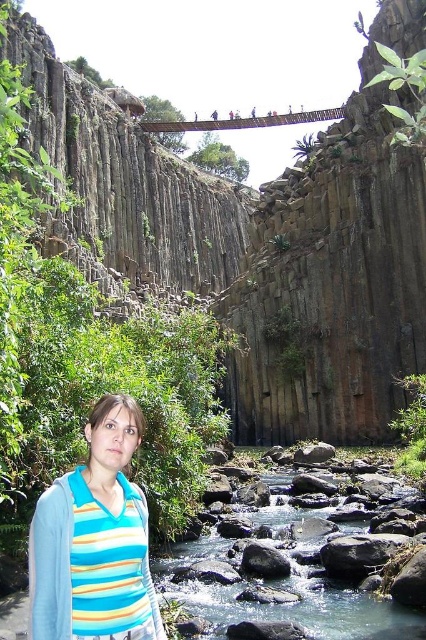
Question: Which of the following is the closest to the observer?

Choices:
 (A) brown rock canyon at center
 (B) gray rock at center
 (C) striped fabric at lower left

Answer: (C)

Question: Is clear water stream at center smaller than gray rock at center?

Choices:
 (A) yes
 (B) no

Answer: (B)

Question: Which object is the closest to the gray rock at center?

Choices:
 (A) brown rock canyon at center
 (B) clear water stream at center
 (C) striped fabric at lower left

Answer: (B)

Question: Where is brown rock canyon at center located in relation to gray rock at center in the image?

Choices:
 (A) above
 (B) below

Answer: (A)

Question: Which object is farther from the camera taking this photo?

Choices:
 (A) gray rock at center
 (B) clear water stream at center

Answer: (A)

Question: Does clear water stream at center appear on the right side of gray rock at center?

Choices:
 (A) yes
 (B) no

Answer: (A)